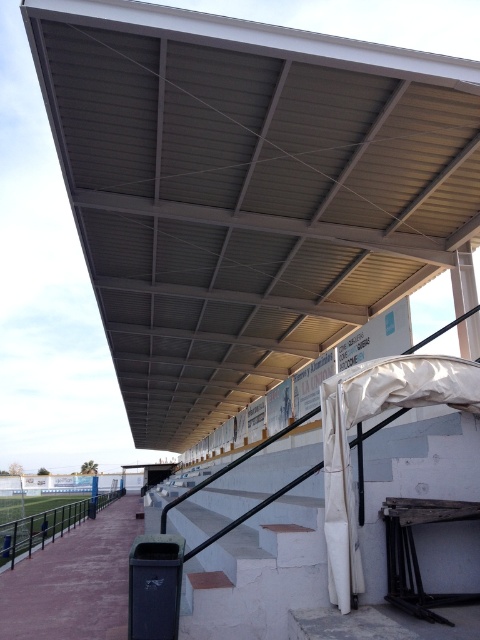
Question: Among these points, which one is nearest to the camera?

Choices:
 (A) (12, 545)
 (B) (216, 179)

Answer: (B)

Question: Observing the image, what is the correct spatial positioning of metallic gray roof at upper center in reference to brushed metal rail at lower left?

Choices:
 (A) above
 (B) below

Answer: (A)

Question: Is metallic gray roof at upper center closer to the viewer compared to brushed metal rail at lower left?

Choices:
 (A) no
 (B) yes

Answer: (B)

Question: Which object is farther from the camera taking this photo?

Choices:
 (A) brushed metal rail at lower left
 (B) metallic gray roof at upper center

Answer: (A)

Question: Does metallic gray roof at upper center appear over brushed metal rail at lower left?

Choices:
 (A) no
 (B) yes

Answer: (B)